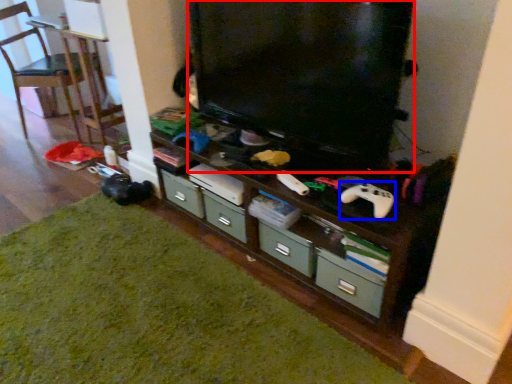
Question: Among these objects, which one is farthest to the camera, television (highlighted by a red box) or game controller (highlighted by a blue box)?

Choices:
 (A) television
 (B) game controller

Answer: (B)